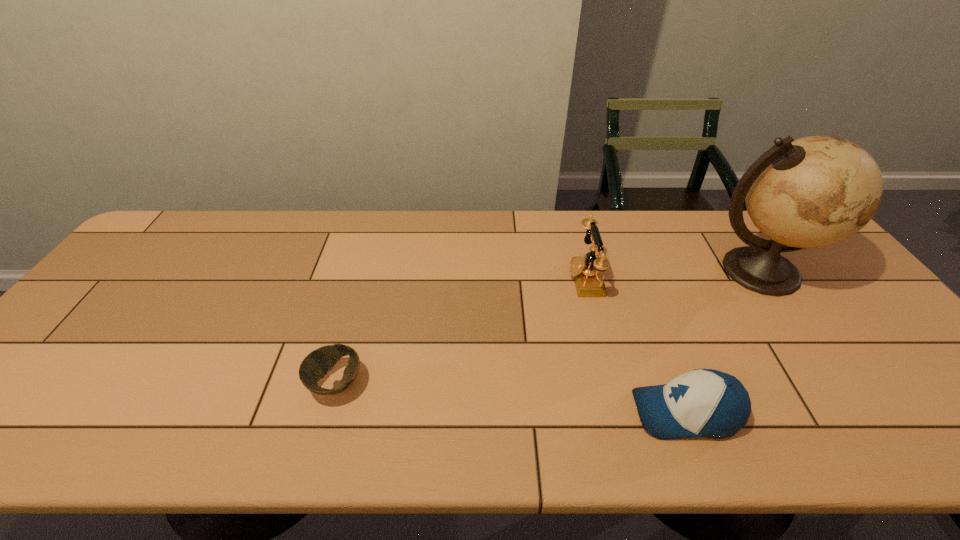
At what (x,y) coordinates should I click in order to perform the action: click on vacant space at the near edge of the desktop. Please return your answer as a coordinate pair (x, y). Looking at the image, I should click on (835, 415).

The width and height of the screenshot is (960, 540). Identify the location of free space at the left edge of the desktop. (46, 373).

I want to click on vacant space at the right edge of the desktop, so click(827, 281).

At what (x,y) coordinates should I click in order to perform the action: click on vacant position at the far left corner of the desktop. Please return your answer as a coordinate pair (x, y). Image resolution: width=960 pixels, height=540 pixels. Looking at the image, I should click on (187, 244).

Locate an element on the screen. The height and width of the screenshot is (540, 960). unoccupied position between the shortest object and the globe is located at coordinates (547, 327).

Image resolution: width=960 pixels, height=540 pixels. What are the coordinates of `free space between the second tallest object and the baseball cap` in the screenshot? It's located at (635, 345).

The width and height of the screenshot is (960, 540). What are the coordinates of `empty space that is in between the baseball cap and the second tallest object` in the screenshot? It's located at (635, 345).

You are a GUI agent. You are given a task and a screenshot of the screen. Output one action in this format:
    pyautogui.click(x=<x>, y=<y>)
    Task: Click on the free spot between the baseball cap and the globe
    The height and width of the screenshot is (540, 960).
    Given the screenshot: What is the action you would take?
    pyautogui.click(x=722, y=342)

Find the location of a particular element. Image resolution: width=960 pixels, height=540 pixels. empty location between the third shortest object and the bowl is located at coordinates (460, 330).

Image resolution: width=960 pixels, height=540 pixels. Identify the location of vacant region between the baseball cap and the globe. (722, 342).